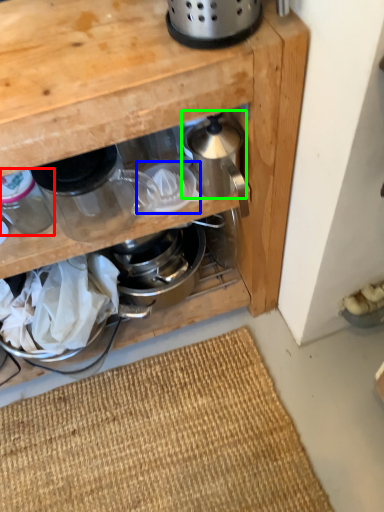
Question: Considering the real-world distances, which object is farthest from appliance (highlighted by a red box)? appliance (highlighted by a blue box) or appliance (highlighted by a green box)?

Choices:
 (A) appliance
 (B) appliance

Answer: (B)